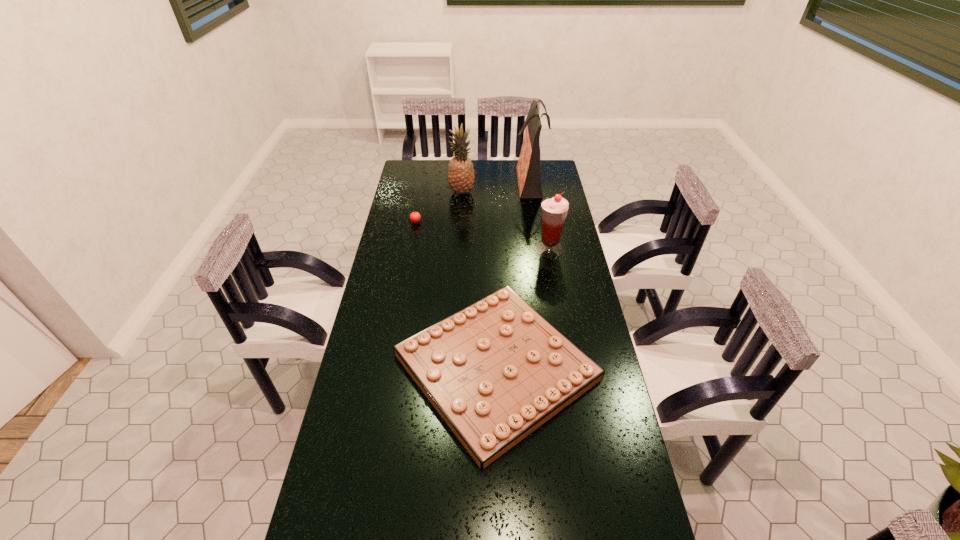
Where is `gameboard at the right edge`? gameboard at the right edge is located at coordinates (495, 371).

I want to click on object positioned at the far right corner, so click(528, 167).

Find the location of a particular element. free region at the far edge is located at coordinates (440, 174).

Find the location of a particular element. This screenshot has height=540, width=960. vacant space at the left edge of the desktop is located at coordinates (357, 369).

Identify the location of vacant space at the right edge of the desktop. This screenshot has width=960, height=540. (544, 280).

You are a GUI agent. You are given a task and a screenshot of the screen. Output one action in this format:
    pyautogui.click(x=<x>, y=<y>)
    Task: Click on the free space between the fourth tallest object and the fourth farthest object
    This screenshot has height=540, width=960.
    Given the screenshot: What is the action you would take?
    pyautogui.click(x=482, y=235)

In order to click on free point between the third farthest object and the shopping bag in this screenshot , I will do `click(472, 201)`.

Find the location of a particular element. The image size is (960, 540). empty space between the third nearest object and the shopping bag is located at coordinates (472, 201).

Where is `vacant area that lies between the pineapple and the shopping bag`? This screenshot has width=960, height=540. vacant area that lies between the pineapple and the shopping bag is located at coordinates (496, 186).

The image size is (960, 540). I want to click on object that is the nearest to the shopping bag, so click(461, 176).